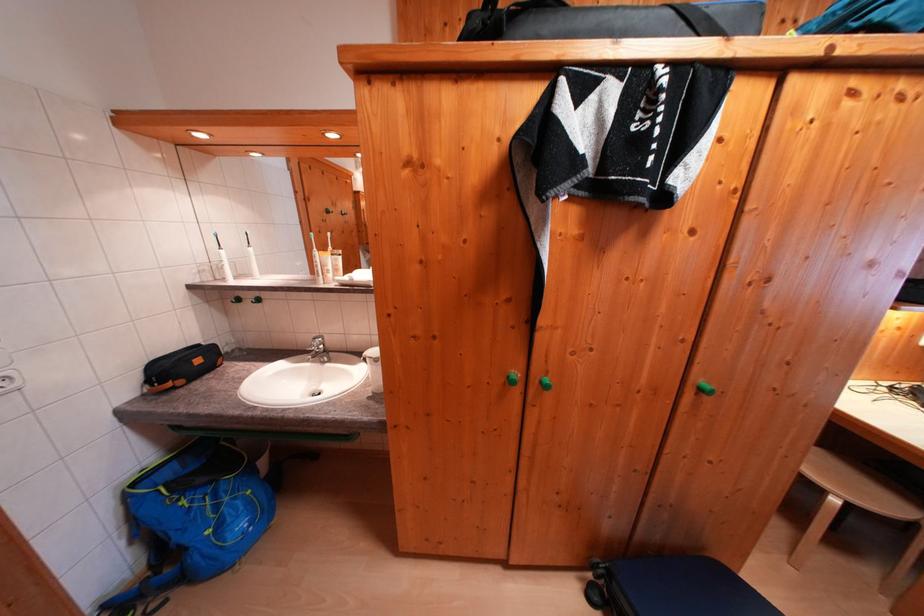
Find the location of a particular element. The height and width of the screenshot is (616, 924). sink faucet handle is located at coordinates (318, 350).